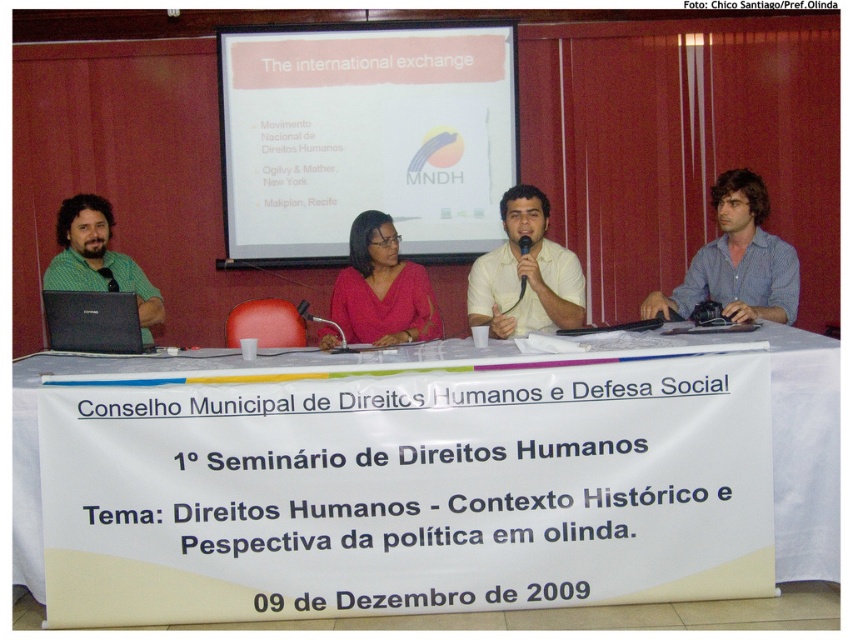
You are attending the conference and want to hand a document to the person wearing the blue striped shirt at right. The black plastic microphone at center is in your way. Can you reach the person without moving the microphone?

The blue striped shirt at right is closer to the viewer than the black plastic microphone at center, so you can reach the person without moving the microphone because the shirt is nearer to you than the microphone.